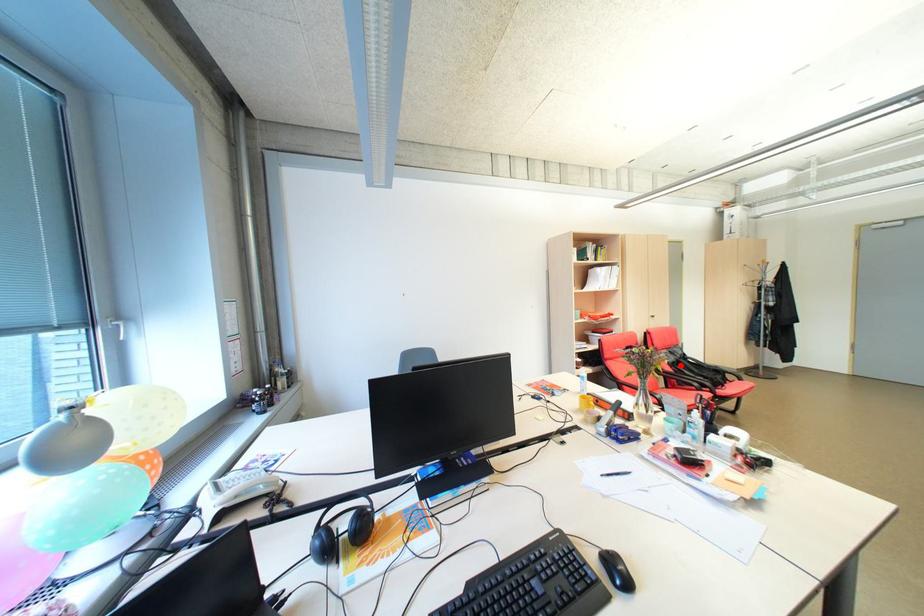
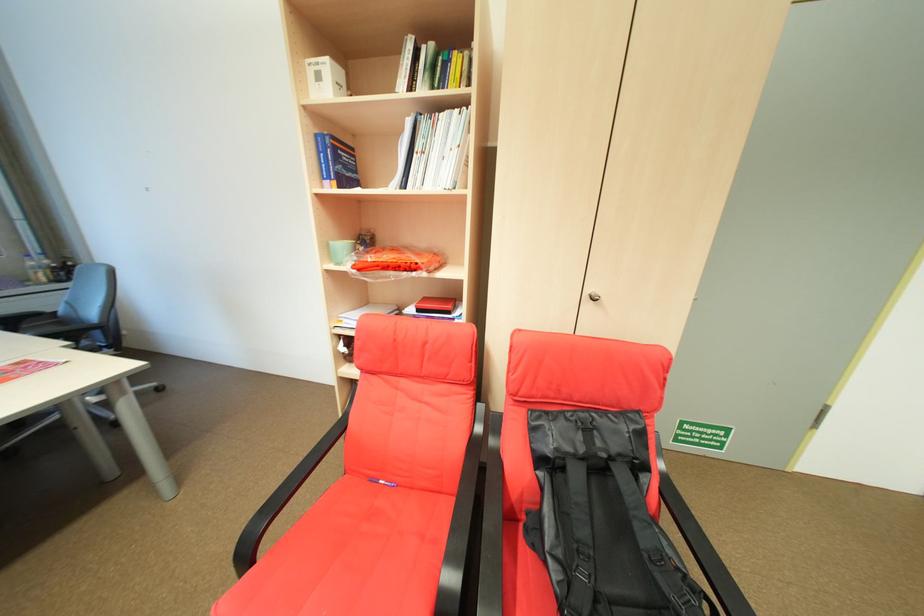
Where in the second image is the point corresponding to the highlighted location from the first image?

(549, 461)